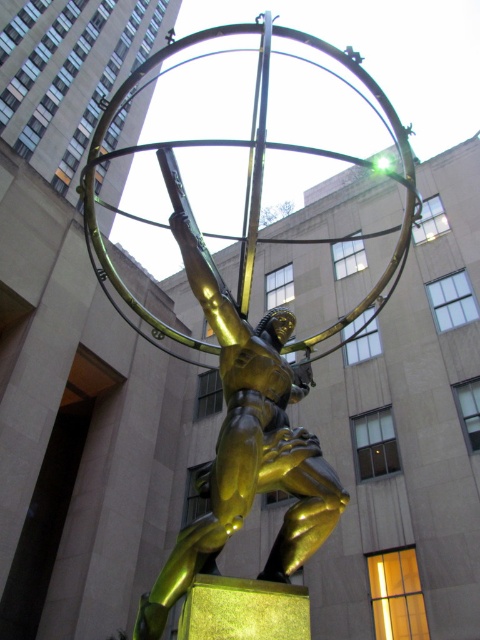
You are an art curator planning to move the shiny gold statue at center and the gold polished statue at center into a gallery. The gallery entrance is 2 meters wide. Can both statues pass through the entrance without rotating them? Please explain your reasoning based on their widths.

The shiny gold statue at center is wider than the gold polished statue at center. Since the entrance is 2 meters wide, we need to know the exact widths of both statues to determine if they can pass. However, the information provided only states that the shiny gold statue at center is wider, but does not specify the exact measurements. Without knowing the actual widths, it is impossible to confirm if both can fit through the 2 meter entrance without rotating them.